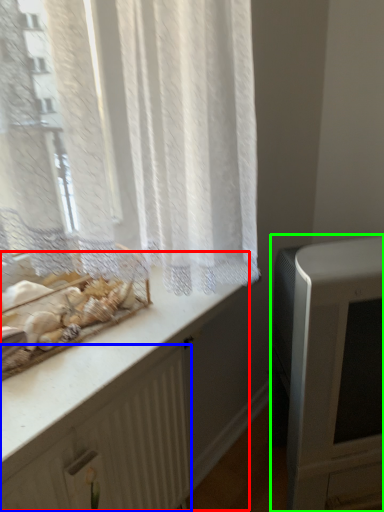
Question: Considering the real-world distances, which object is farthest from counter (highlighted by a red box)? radiator (highlighted by a blue box) or appliance (highlighted by a green box)?

Choices:
 (A) radiator
 (B) appliance

Answer: (B)